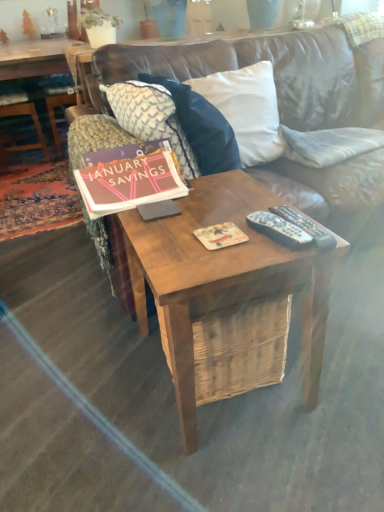
Find the location of a particular element. vacant region above wooden table at center (from a real-world perspective) is located at coordinates (210, 217).